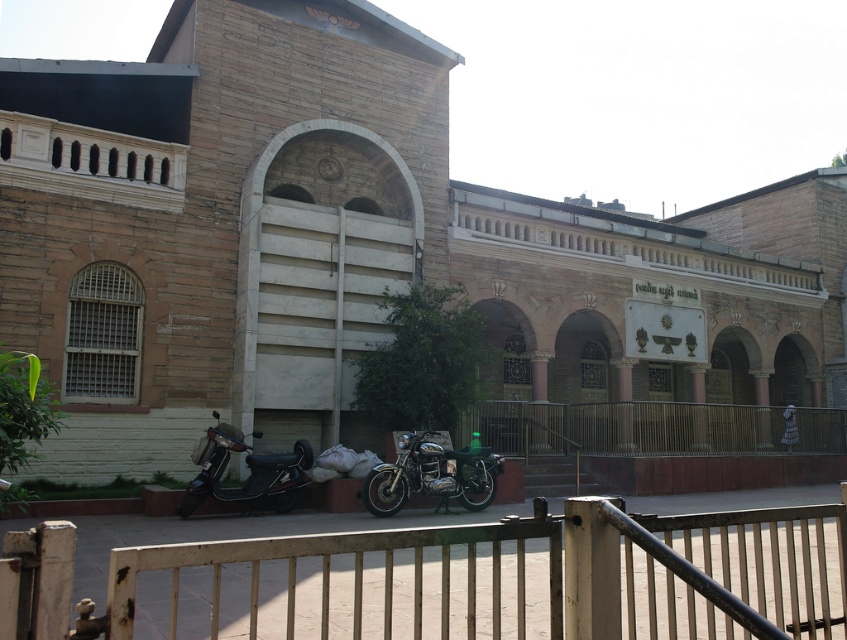
You are standing in front of the building and want to walk towards the entrance. There are two points marked on the ground in front of you, one at coordinate point (401, 465) and another at point (220, 440). Which point is closer to you as you face the building?

Point (401, 465) is closer to you because it is further to the viewer than point (220, 440).

You are a visitor arriving at the building and need to park your bicycle between the shiny metallic motorcycle at center and the black matte scooter at lower left. Which vehicle should you place your bicycle closer to if you want it to be closer to the entrance?

The shiny metallic motorcycle at center is shorter than the black matte scooter at lower left, so placing the bicycle closer to the shiny metallic motorcycle at center would position it nearer to the entrance.